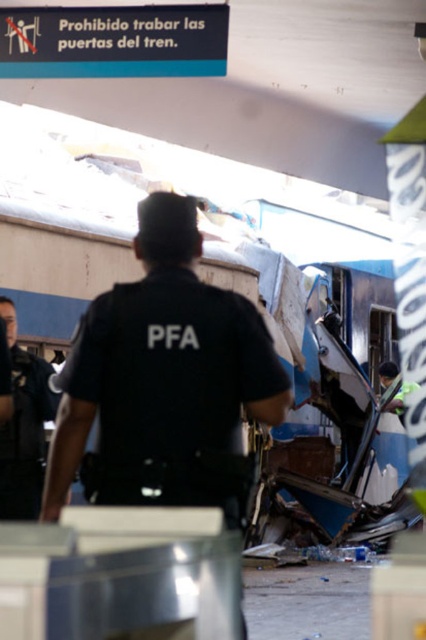
From the picture: You are an observer at the train station. You notice two uniforms in the scene. The first is the black uniform at center, and the second is the dark blue uniform at left. Which uniform is positioned higher from the ground?

The black uniform at center is located above the dark blue uniform at left, so it is positioned higher from the ground.

You are a police officer at the scene of a train collision. You need to quickly assess the situation. Where is the black uniform at center located in terms of coordinates?

The black uniform at center is located at coordinates point (161, 369).

You are a bystander at the train station and see the black uniform at center and the dark blue uniform at left. Which uniform is positioned closer to the right side of the platform?

The black uniform at center is positioned to the right of the dark blue uniform at left, so the black uniform at center is closer to the right side of the platform.